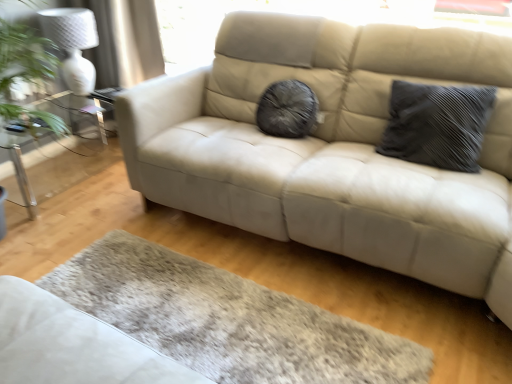
Question: Considering the relative sizes of clear glass table at left and white textured lamp at upper left in the image provided, is clear glass table at left bigger than white textured lamp at upper left?

Choices:
 (A) yes
 (B) no

Answer: (A)

Question: Is clear glass table at left next to white textured lamp at upper left?

Choices:
 (A) yes
 (B) no

Answer: (B)

Question: Does clear glass table at left come behind white textured lamp at upper left?

Choices:
 (A) yes
 (B) no

Answer: (B)

Question: Does clear glass table at left turn towards white textured lamp at upper left?

Choices:
 (A) no
 (B) yes

Answer: (A)

Question: Is clear glass table at left positioned with its back to white textured lamp at upper left?

Choices:
 (A) no
 (B) yes

Answer: (A)

Question: Is clear glass table at left in front of white textured lamp at upper left?

Choices:
 (A) yes
 (B) no

Answer: (A)

Question: Does white textured lamp at upper left have a smaller size compared to clear glass table at left?

Choices:
 (A) yes
 (B) no

Answer: (A)

Question: Is white textured lamp at upper left behind clear glass table at left?

Choices:
 (A) no
 (B) yes

Answer: (B)

Question: Is white textured lamp at upper left aimed at clear glass table at left?

Choices:
 (A) yes
 (B) no

Answer: (B)

Question: Is clear glass table at left inside white textured lamp at upper left?

Choices:
 (A) no
 (B) yes

Answer: (A)

Question: Is white textured lamp at upper left taller than clear glass table at left?

Choices:
 (A) no
 (B) yes

Answer: (B)

Question: Is white textured lamp at upper left oriented away from clear glass table at left?

Choices:
 (A) no
 (B) yes

Answer: (A)

Question: Is dark gray textured pillow at right oriented away from white textured lamp at upper left?

Choices:
 (A) yes
 (B) no

Answer: (B)